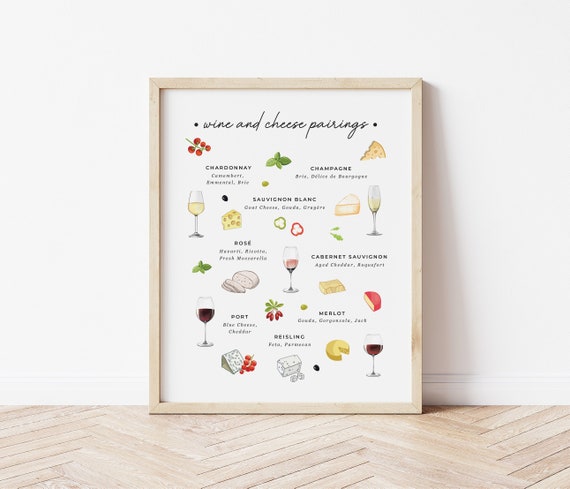
The image size is (570, 489). I want to click on light wood floor, so click(x=75, y=461).